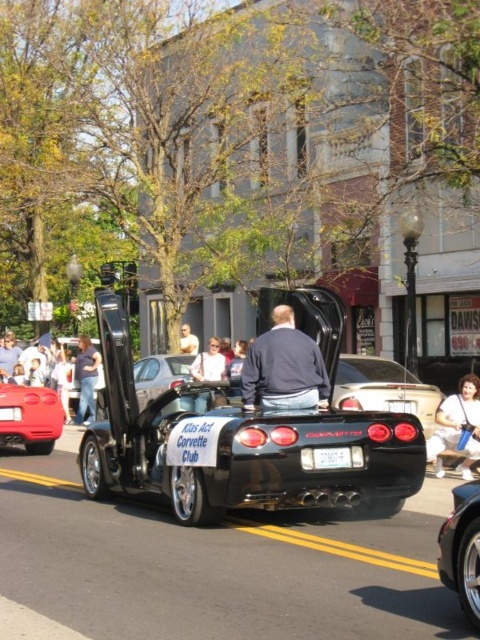
You are a pedestrian standing on the sidewalk next to the black glossy convertible at center and the shiny silver car at center. You want to cross the street to the park on the other side. Is there enough space between the two cars to safely walk through?

The distance between the black glossy convertible at center and the shiny silver car at center is 5.51 meters, which is more than enough space for a pedestrian to safely walk through.

You are a photographer positioned at the end of the street. You want to take a photo of both the black glossy convertible at center and the shiny silver car at center. Which car should you focus on first to ensure both are in sharp focus?

You should focus on the black glossy convertible at center first because it is closer to the viewer than the shiny silver car at center, so focusing on the closer object will help keep both in focus.

You are standing on the street and see the black Chevrolet Corvette with its doors open. There is a point marked at coordinates (463, 548). Can you tell me which object this point is located on?

The point marked at coordinates (463, 548) is located on the black Chevrolet Corvette at center.